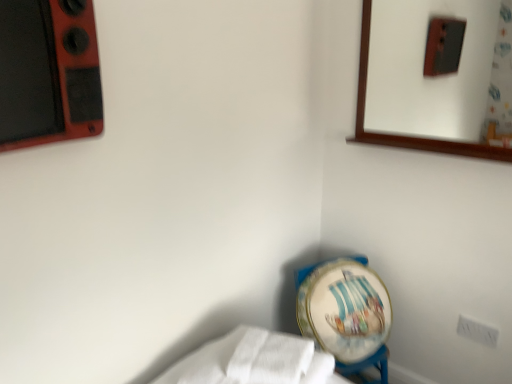
What do you see at coordinates (477, 331) in the screenshot?
I see `white plastic electric outlet at lower right` at bounding box center [477, 331].

This screenshot has height=384, width=512. What do you see at coordinates (253, 361) in the screenshot?
I see `white fabric at lower left` at bounding box center [253, 361].

Measure the distance between white fabric at lower left and camera.

white fabric at lower left and camera are 1.16 meters apart from each other.

This screenshot has width=512, height=384. Describe the element at coordinates (344, 308) in the screenshot. I see `painted ceramic globe at lower center` at that location.

What do you see at coordinates (440, 69) in the screenshot? The width and height of the screenshot is (512, 384). I see `wooden-framed mirror at upper right` at bounding box center [440, 69].

At what (x,y) coordinates should I click in order to perform the action: click on white plastic electric outlet at lower right. Please return your answer as a coordinate pair (x, y). This screenshot has width=512, height=384. Looking at the image, I should click on (477, 331).

From a real-world perspective, is wooden-framed mirror at upper right located beneath painted ceramic globe at lower center?

No, from a real-world perspective, wooden-framed mirror at upper right is not under painted ceramic globe at lower center.

Consider the image. From the image's perspective, is wooden-framed mirror at upper right located above painted ceramic globe at lower center?

Correct, wooden-framed mirror at upper right appears higher than painted ceramic globe at lower center in the image.

Could you tell me if wooden-framed mirror at upper right is facing painted ceramic globe at lower center?

No, wooden-framed mirror at upper right is not facing towards painted ceramic globe at lower center.

Which is in front, point (309, 291) or point (481, 338)?

The point (481, 338) is closer.

Is painted ceramic globe at lower center far away from white plastic electric outlet at lower right?

They are positioned close to each other.

How many degrees apart are the facing directions of painted ceramic globe at lower center and white plastic electric outlet at lower right?

There is a 63.4-degree angle between the facing directions of painted ceramic globe at lower center and white plastic electric outlet at lower right.

Considering the positions of points (380, 8) and (486, 331), is point (380, 8) farther from camera compared to point (486, 331)?

That is True.

Choose the correct answer: Is wooden-framed mirror at upper right inside white plastic electric outlet at lower right or outside it?

wooden-framed mirror at upper right is not enclosed by white plastic electric outlet at lower right.

Considering the positions of objects wooden-framed mirror at upper right and white plastic electric outlet at lower right in the image provided, who is more to the left, wooden-framed mirror at upper right or white plastic electric outlet at lower right?

wooden-framed mirror at upper right.

Is there a large distance between wooden-framed mirror at upper right and white plastic electric outlet at lower right?

Yes, wooden-framed mirror at upper right and white plastic electric outlet at lower right are quite far apart.

Looking at this image, from a real-world perspective, which object stands above the other?

white fabric at lower left is physically above.

Is white plastic electric outlet at lower right taller than white fabric at lower left?

Correct, white plastic electric outlet at lower right is much taller as white fabric at lower left.

From a real-world perspective, is white plastic electric outlet at lower right on wooden-framed mirror at upper right?

No, from a real-world perspective, white plastic electric outlet at lower right is not above wooden-framed mirror at upper right.

Is white plastic electric outlet at lower right positioned with its back to wooden-framed mirror at upper right?

That's not correct — white plastic electric outlet at lower right is not looking away from wooden-framed mirror at upper right.

Locate an element on the screen. The height and width of the screenshot is (384, 512). mirror lying above the white plastic electric outlet at lower right (from the image's perspective) is located at coordinates (440, 69).

From the image's perspective, between white plastic electric outlet at lower right and wooden-framed mirror at upper right, which one is located above?

From the image's view, wooden-framed mirror at upper right is above.

What's the angular difference between wooden-framed mirror at upper right and white fabric at lower left's facing directions?

wooden-framed mirror at upper right and white fabric at lower left are facing 167 degrees away from each other.

Is point (498, 40) farther from camera compared to point (212, 354)?

Yes, point (498, 40) is behind point (212, 354).

Are wooden-framed mirror at upper right and white fabric at lower left far apart?

Indeed, wooden-framed mirror at upper right is not near white fabric at lower left.

Considering the positions of point (256, 382) and point (349, 350), is point (256, 382) closer or farther from the camera than point (349, 350)?

Point (256, 382) appears to be closer to the viewer than point (349, 350).

Consider the image. From a real-world perspective, which is physically below, white fabric at lower left or painted ceramic globe at lower center?

painted ceramic globe at lower center.

Is the depth of white fabric at lower left greater than that of painted ceramic globe at lower center?

That is False.

Is white fabric at lower left facing away from painted ceramic globe at lower center?

white fabric at lower left does not have its back to painted ceramic globe at lower center.

Where is `mirror located in front of the painted ceramic globe at lower center`? This screenshot has width=512, height=384. mirror located in front of the painted ceramic globe at lower center is located at coordinates (440, 69).

Where is `electric outlet on the right side of painted ceramic globe at lower center`? electric outlet on the right side of painted ceramic globe at lower center is located at coordinates (477, 331).

Based on their spatial positions, is painted ceramic globe at lower center or white fabric at lower left closer to wooden-framed mirror at upper right?

painted ceramic globe at lower center is positioned closer to the anchor wooden-framed mirror at upper right.

Estimate the real-world distances between objects in this image. Which object is closer to white plastic electric outlet at lower right, white fabric at lower left or painted ceramic globe at lower center?

painted ceramic globe at lower center.

When comparing their distances from painted ceramic globe at lower center, does white plastic electric outlet at lower right or wooden-framed mirror at upper right seem closer?

Among the two, white plastic electric outlet at lower right is located nearer to painted ceramic globe at lower center.

Based on their spatial positions, is white fabric at lower left or wooden-framed mirror at upper right closer to painted ceramic globe at lower center?

Among the two, white fabric at lower left is located nearer to painted ceramic globe at lower center.

Which object lies further to the anchor point white fabric at lower left, painted ceramic globe at lower center or wooden-framed mirror at upper right?

wooden-framed mirror at upper right lies further to white fabric at lower left than the other object.

From the image, which object appears to be farther from painted ceramic globe at lower center, wooden-framed mirror at upper right or white plastic electric outlet at lower right?

wooden-framed mirror at upper right is further to painted ceramic globe at lower center.

From the image, which object appears to be nearer to painted ceramic globe at lower center, wooden-framed mirror at upper right or white fabric at lower left?

white fabric at lower left is closer to painted ceramic globe at lower center.

From the image, which object appears to be farther from white fabric at lower left, white plastic electric outlet at lower right or painted ceramic globe at lower center?

white plastic electric outlet at lower right is positioned further to the anchor white fabric at lower left.

What are the coordinates of `electric outlet between wooden-framed mirror at upper right and painted ceramic globe at lower center vertically` in the screenshot? It's located at (477, 331).

Locate an element on the screen. The height and width of the screenshot is (384, 512). platter between white fabric at lower left and white plastic electric outlet at lower right is located at coordinates (344, 308).

At what (x,y) coordinates should I click in order to perform the action: click on sheet between wooden-framed mirror at upper right and white plastic electric outlet at lower right in the vertical direction. Please return your answer as a coordinate pair (x, y). Image resolution: width=512 pixels, height=384 pixels. Looking at the image, I should click on (253, 361).

Where is `sheet that lies between wooden-framed mirror at upper right and painted ceramic globe at lower center from top to bottom`? This screenshot has width=512, height=384. sheet that lies between wooden-framed mirror at upper right and painted ceramic globe at lower center from top to bottom is located at coordinates (253, 361).